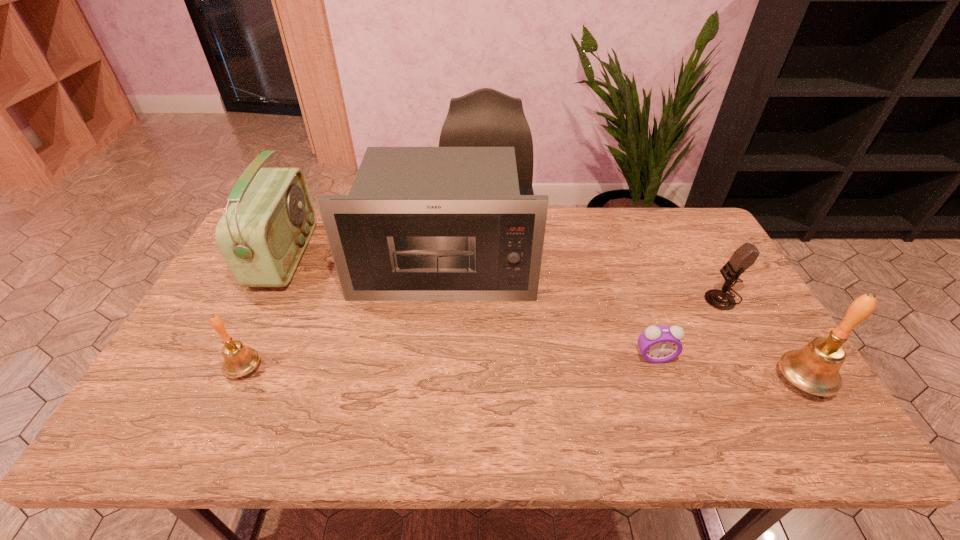
What are the coordinates of `free space that satisfies the following two spatial constraints: 1. on the face of the alarm clock; 2. on the right side of the taller bell` in the screenshot? It's located at (x=663, y=381).

Locate an element on the screen. The height and width of the screenshot is (540, 960). vacant space that satisfies the following two spatial constraints: 1. on the front panel of the radio receiver; 2. on the right side of the right bell is located at coordinates (222, 381).

In order to click on vacant space that satisfies the following two spatial constraints: 1. on the front panel of the shorter bell; 2. on the left side of the radio receiver in this screenshot , I will do `click(228, 368)`.

Find the location of a particular element. vacant space that satisfies the following two spatial constraints: 1. on the back side of the taller bell; 2. on the front panel of the radio receiver is located at coordinates (725, 256).

The height and width of the screenshot is (540, 960). What are the coordinates of `blank area in the image that satisfies the following two spatial constraints: 1. on the front-facing side of the microphone; 2. on the face of the shortest object` in the screenshot? It's located at (756, 357).

Image resolution: width=960 pixels, height=540 pixels. Find the location of `free space that satisfies the following two spatial constraints: 1. on the front panel of the radio receiver; 2. on the left side of the taller bell`. free space that satisfies the following two spatial constraints: 1. on the front panel of the radio receiver; 2. on the left side of the taller bell is located at coordinates (222, 381).